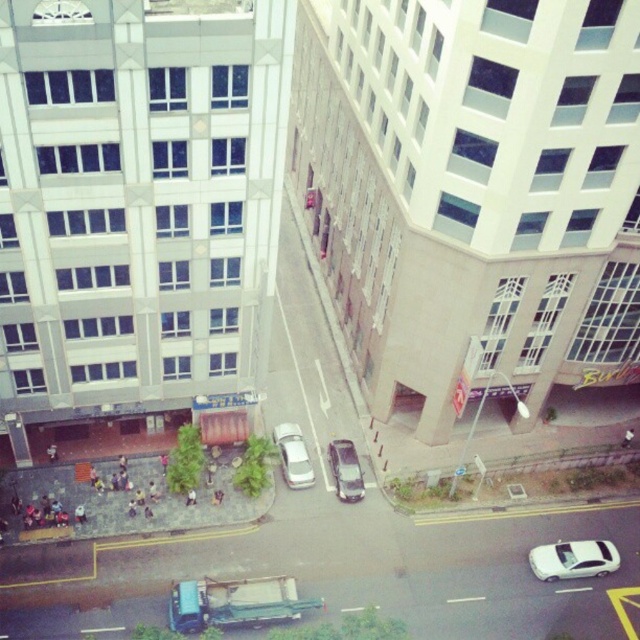
Question: Considering the relative positions of white matte car at lower right and satin silver car at center in the image provided, where is white matte car at lower right located with respect to satin silver car at center?

Choices:
 (A) left
 (B) right

Answer: (B)

Question: Is white matte car at lower right to the left of satin silver car at center from the viewer's perspective?

Choices:
 (A) no
 (B) yes

Answer: (A)

Question: Which point is farther to the camera?

Choices:
 (A) white matte car at center
 (B) white matte car at lower right

Answer: (A)

Question: Among these objects, which one is farthest from the camera?

Choices:
 (A) white matte car at center
 (B) white matte car at lower right
 (C) satin silver car at center

Answer: (A)

Question: Which of the following is the closest to the observer?

Choices:
 (A) white matte car at center
 (B) satin silver car at center
 (C) white matte car at lower right

Answer: (C)

Question: Observing the image, what is the correct spatial positioning of white matte car at center in reference to satin silver car at center?

Choices:
 (A) below
 (B) above

Answer: (B)